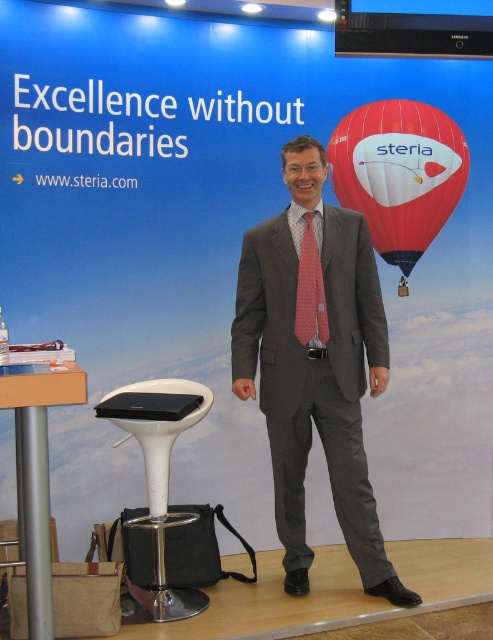
Does point (417, 186) lie behind point (309, 273)?

Yes, it is behind point (309, 273).

Is red glossy hot air balloon at upper right positioned behind pink dotted tie at center?

Yes.

Is point (329, 179) positioned behind point (317, 272)?

Yes, it is behind point (317, 272).

I want to click on red glossy hot air balloon at upper right, so click(x=398, y=173).

Who is higher up, gray suit at center or white plastic bar stool at lower left?

Positioned higher is gray suit at center.

Does gray suit at center have a lesser height compared to white plastic bar stool at lower left?

Incorrect, gray suit at center's height does not fall short of white plastic bar stool at lower left's.

This screenshot has width=493, height=640. Identify the location of gray suit at center. (315, 362).

Consider the image. Does red glossy hot air balloon at upper right have a larger size compared to white plastic bar stool at lower left?

Incorrect, red glossy hot air balloon at upper right is not larger than white plastic bar stool at lower left.

Which is above, red glossy hot air balloon at upper right or white plastic bar stool at lower left?

red glossy hot air balloon at upper right is higher up.

Identify the location of red glossy hot air balloon at upper right. This screenshot has width=493, height=640. (398, 173).